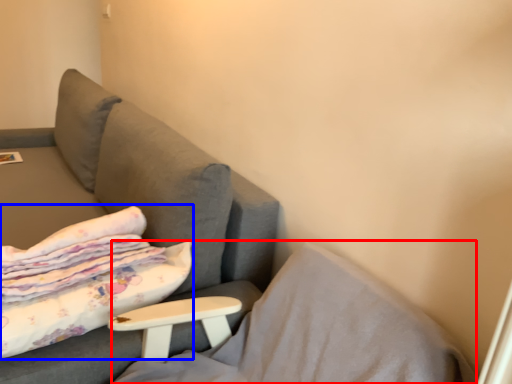
Question: Which object appears closest to the camera in this image, pillow (highlighted by a red box) or bed (highlighted by a blue box)?

Choices:
 (A) pillow
 (B) bed

Answer: (A)